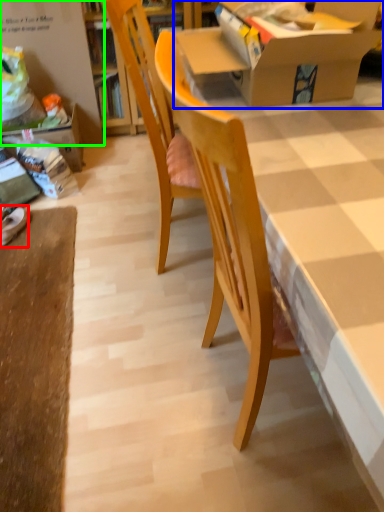
Question: Which object is the farthest from footwear (highlighted by a red box)? Choose among these: box (highlighted by a blue box) or bulletin board (highlighted by a green box).

Choices:
 (A) box
 (B) bulletin board

Answer: (A)